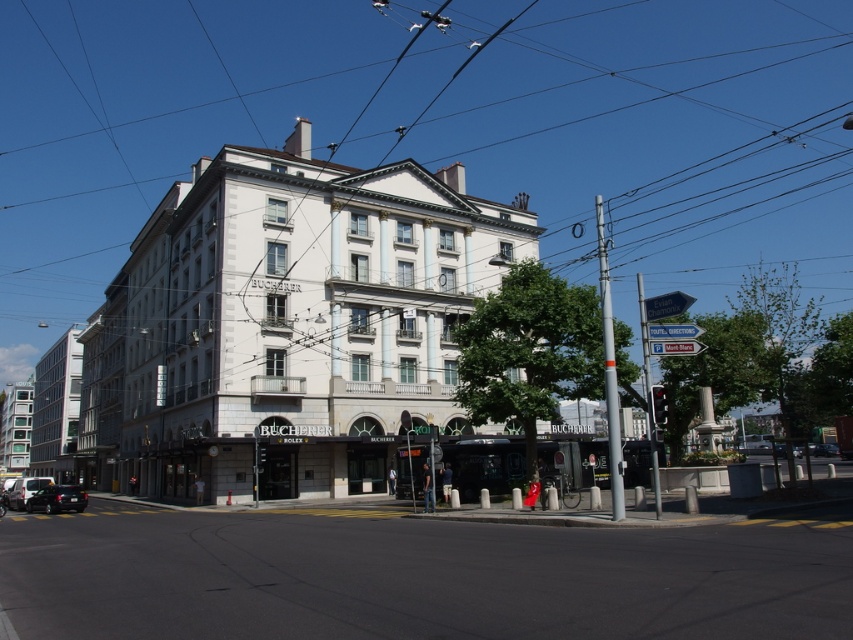
You are standing at the tram stop in front of the BUCHERER building and want to cross the street to reach the other side. The black asphalt road at lower center is between you and the shiny black car at lower left. Which object is closer to you as you prepare to cross?

The black asphalt road at lower center is closer to the viewer than the shiny black car at lower left, so the road is closer to you as you prepare to cross.

You are a delivery person who needs to park your shiny black car at lower left near the Bucherer building. The parking space available is the size of the black asphalt road at lower center. Will your car fit in the parking space?

The black asphalt road at lower center has a smaller size compared to shiny black car at lower left. Therefore, the car will not fit in the parking space as the space is smaller than the car.